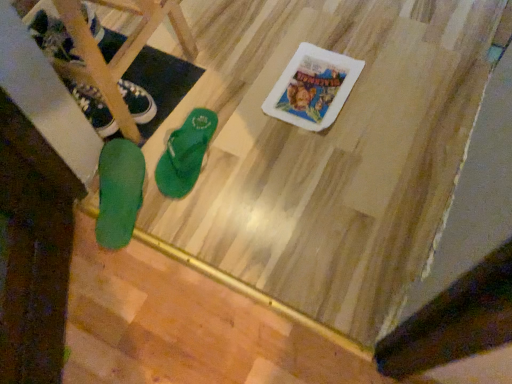
Question: Should I look upward or downward to see green rubber flip-flop at lower left, the 2th footwear positioned from the left?

Choices:
 (A) up
 (B) down

Answer: (A)

Question: Is green rubber flip-flop at center, marked as the first footwear in a right-to-left arrangement, wider than green rubber flip-flop at lower left, the 3th footwear when ordered from right to left?

Choices:
 (A) yes
 (B) no

Answer: (A)

Question: Can you confirm if green rubber flip-flop at center, marked as the first footwear in a right-to-left arrangement, is smaller than green rubber flip-flop at lower left, the 3th footwear when ordered from right to left?

Choices:
 (A) yes
 (B) no

Answer: (B)

Question: Would you say green rubber flip-flop at lower left, the 3th footwear when ordered from right to left, is part of green rubber flip-flop at center, the third footwear from the left,'s contents?

Choices:
 (A) no
 (B) yes

Answer: (A)

Question: Can you confirm if green rubber flip-flop at center, marked as the first footwear in a right-to-left arrangement, is taller than green rubber flip-flop at lower left, which appears as the first footwear when viewed from the left?

Choices:
 (A) no
 (B) yes

Answer: (A)

Question: Can you confirm if green rubber flip-flop at center, marked as the first footwear in a right-to-left arrangement, is shorter than green rubber flip-flop at lower left, which appears as the first footwear when viewed from the left?

Choices:
 (A) no
 (B) yes

Answer: (B)

Question: Would you consider green rubber flip-flop at center, the third footwear from the left, to be distant from green rubber flip-flop at lower left, the 3th footwear when ordered from right to left?

Choices:
 (A) yes
 (B) no

Answer: (B)

Question: Can you confirm if green rubber flip-flop at lower left, the 3th footwear when ordered from right to left, is thinner than green rubber flip-flop at center, the third footwear from the left?

Choices:
 (A) yes
 (B) no

Answer: (A)

Question: Could you tell me if green rubber flip-flop at lower left, the 3th footwear when ordered from right to left, is turned towards green rubber flip-flop at center, marked as the first footwear in a right-to-left arrangement?

Choices:
 (A) yes
 (B) no

Answer: (B)

Question: From the image's perspective, is green rubber flip-flop at lower left, which appears as the first footwear when viewed from the left, over green rubber flip-flop at center, the third footwear from the left?

Choices:
 (A) yes
 (B) no

Answer: (A)

Question: From a real-world perspective, is green rubber flip-flop at lower left, the 3th footwear when ordered from right to left, physically above green rubber flip-flop at center, marked as the first footwear in a right-to-left arrangement?

Choices:
 (A) yes
 (B) no

Answer: (A)

Question: Does green rubber flip-flop at lower left, the 3th footwear when ordered from right to left, appear on the left side of green rubber flip-flop at center, marked as the first footwear in a right-to-left arrangement?

Choices:
 (A) yes
 (B) no

Answer: (A)

Question: From a real-world perspective, is green rubber flip-flop at lower left, the 3th footwear when ordered from right to left, below green rubber flip-flop at center, the third footwear from the left?

Choices:
 (A) yes
 (B) no

Answer: (B)

Question: From the image's perspective, does green rubber flip-flop at lower left, the 2th footwear positioned from the left, appear lower than green rubber flip-flop at lower left, the 3th footwear when ordered from right to left?

Choices:
 (A) no
 (B) yes

Answer: (B)